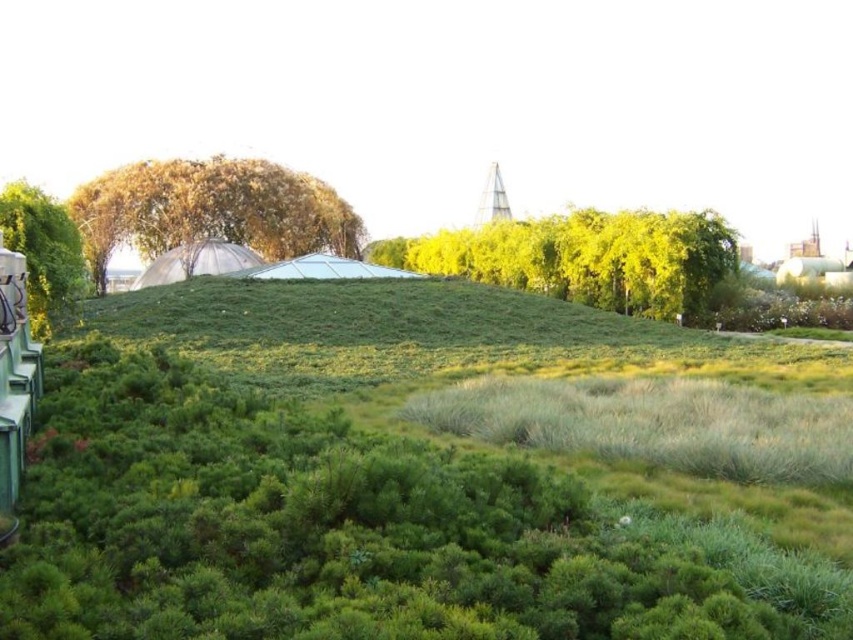
Question: Can you confirm if green leafy tree at center is thinner than golden textured tree at upper left?

Choices:
 (A) yes
 (B) no

Answer: (B)

Question: Which point is closer to the camera taking this photo?

Choices:
 (A) (305, 212)
 (B) (674, 250)

Answer: (B)

Question: Which is farther from the golden textured tree at upper left?

Choices:
 (A) green leafy tree at left
 (B) green leafy tree at center

Answer: (A)

Question: Is golden textured tree at upper left positioned behind green leafy tree at left?

Choices:
 (A) no
 (B) yes

Answer: (B)

Question: Among these objects, which one is nearest to the camera?

Choices:
 (A) green leafy tree at center
 (B) golden textured tree at upper left
 (C) green leafy tree at left

Answer: (C)

Question: Can you confirm if green leafy tree at center is positioned above green leafy tree at left?

Choices:
 (A) no
 (B) yes

Answer: (B)